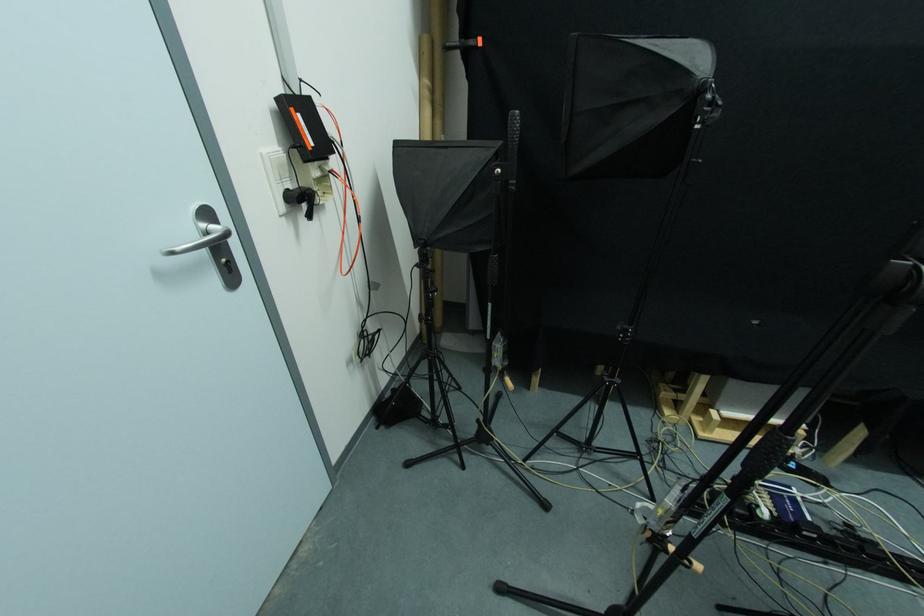
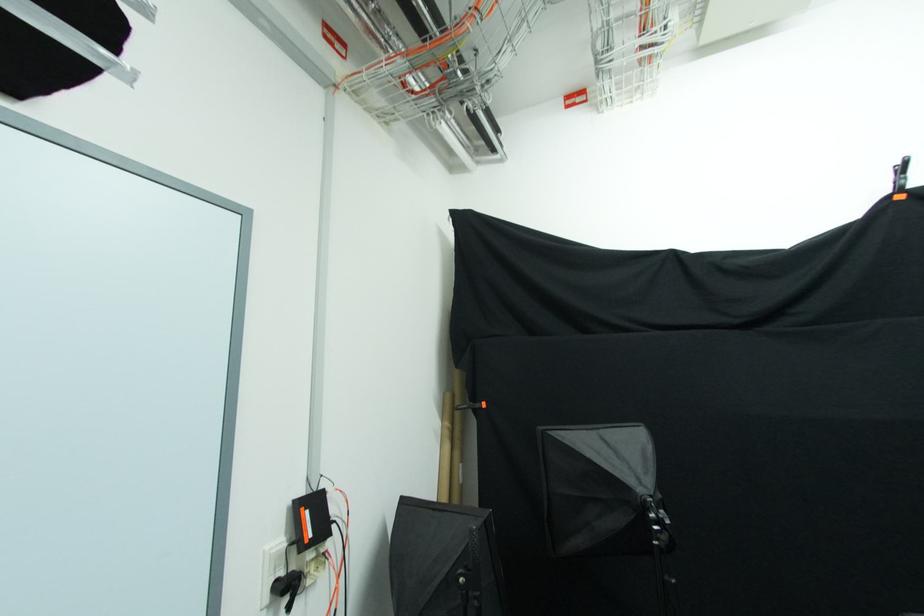
Question: I am providing you with two images of the same scene from different viewpoints. Which of the following objects are not visible in image2?

Choices:
 (A) black power adapter
 (B) black power plug
 (C) cardboard tube
 (D) none of these

Answer: (D)